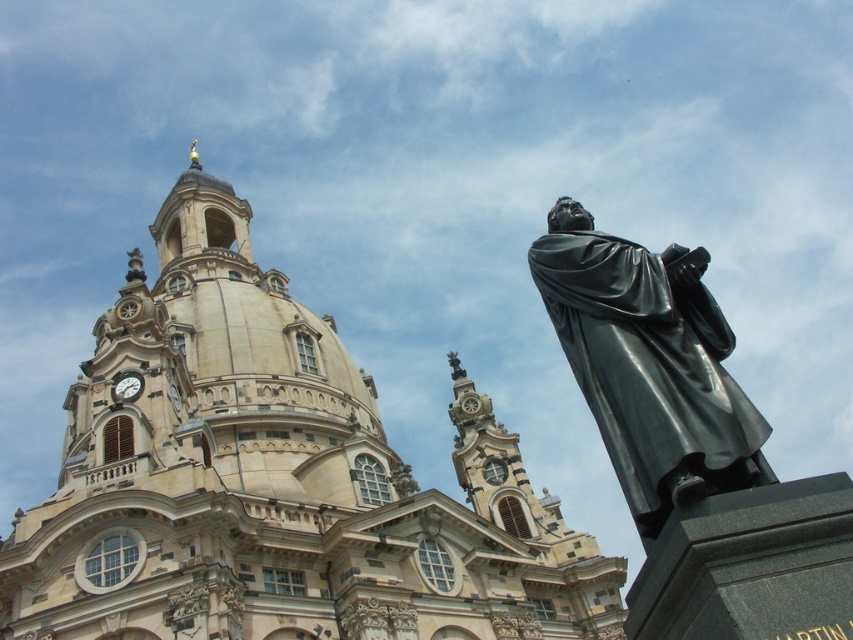
You are an architect assessing the proportions of the beige stone church at center and the black polished statue at right in the image. Which structure is taller?

The beige stone church at center is taller than the black polished statue at right.

You are an architect planning to place a new sculpture in front of the beige stone church at center. The sculpture must not exceed the width of the church. Given that the black polished statue at right is currently placed there, can you confirm if the new sculpture can be as wide as the church without exceeding the space?

The beige stone church at center is wider than the black polished statue at right. Since the new sculpture must not exceed the church width, it can be as wide as the church, provided there is enough space in the current layout.

You are standing in front of the beige stone church at center and want to take a photo of the black polished statue at right. Since the statue is smaller than the church, where should you position yourself to ensure the statue is fully visible in the frame without the church blocking it?

The beige stone church at center is located above the black polished statue at right, so to capture the statue without obstruction, position yourself lower or move to a position where the church is not directly above the statue in your field of view.